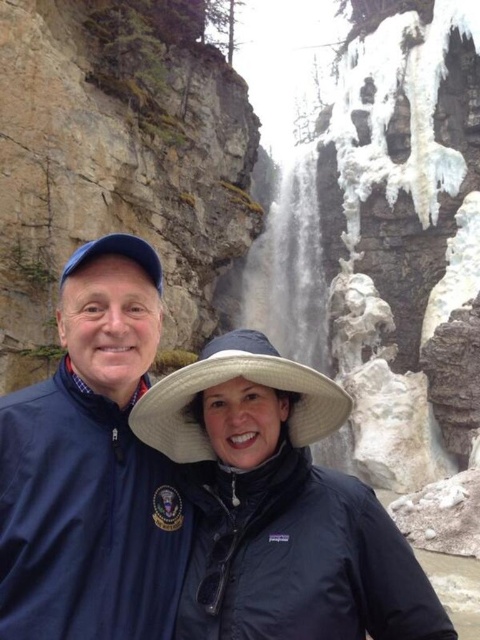
Which is in front, point (233, 385) or point (47, 509)?

Positioned in front is point (47, 509).

Is the position of black matte jacket at center more distant than that of blue fabric jacket at left?

Yes, black matte jacket at center is behind blue fabric jacket at left.

Measure the distance between point (192, 564) and camera.

44.71 meters

Where is `black matte jacket at center`? The height and width of the screenshot is (640, 480). black matte jacket at center is located at coordinates (278, 506).